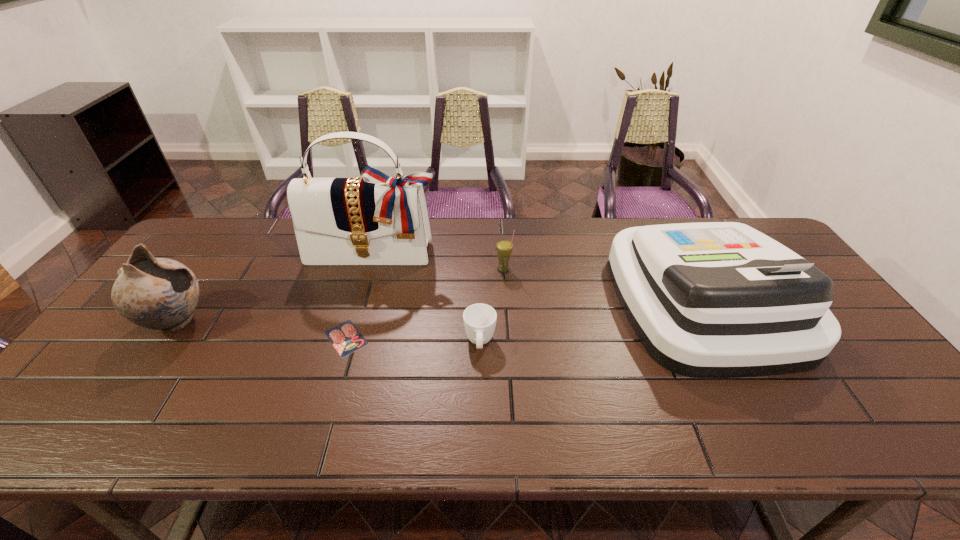
The width and height of the screenshot is (960, 540). Find the location of `the tallest object`. the tallest object is located at coordinates (373, 219).

Where is `cash register`? cash register is located at coordinates (714, 299).

Find the location of a particular element. The image size is (960, 540). pottery is located at coordinates (161, 294).

In order to click on straw for drinking in this screenshot , I will do `click(504, 247)`.

At what (x,y) coordinates should I click in order to perform the action: click on the second object from right to left. Please return your answer as a coordinate pair (x, y). Looking at the image, I should click on (504, 247).

The height and width of the screenshot is (540, 960). In order to click on cup in this screenshot , I will do `click(479, 319)`.

Locate an element on the screen. The image size is (960, 540). the third object from right to left is located at coordinates (479, 319).

Find the location of a particular element. The width and height of the screenshot is (960, 540). salami is located at coordinates (345, 337).

The width and height of the screenshot is (960, 540). What are the coordinates of `vacant space situated on the front-facing side of the tallest object` in the screenshot? It's located at (358, 308).

Where is `vacant space located 0.120m on the back of the rightmost object`? The width and height of the screenshot is (960, 540). vacant space located 0.120m on the back of the rightmost object is located at coordinates (662, 224).